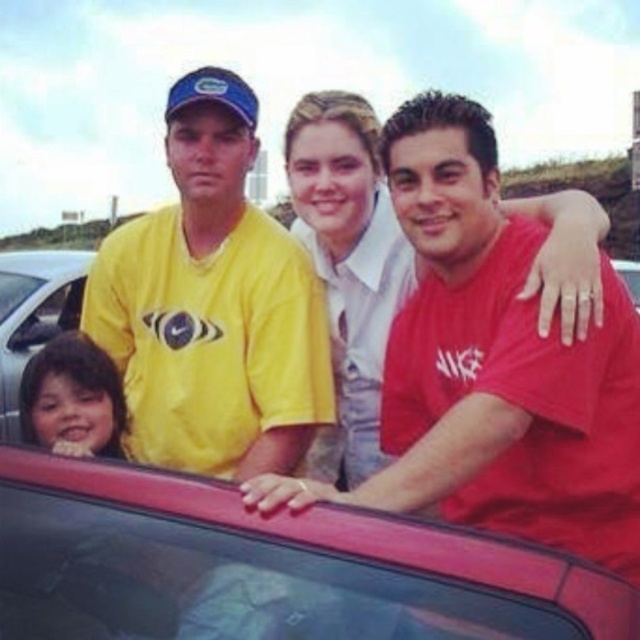
Consider the image. You are a delivery person who needs to place a package between the transparent glass car window at center and the metallic silver car at lower left. The package requires 6 meters of space to be placed safely. Can you fit it there?

The transparent glass car window at center and metallic silver car at lower left are 5.59 meters apart, which is less than the required 6 meters. Therefore, the package cannot be safely placed between them.